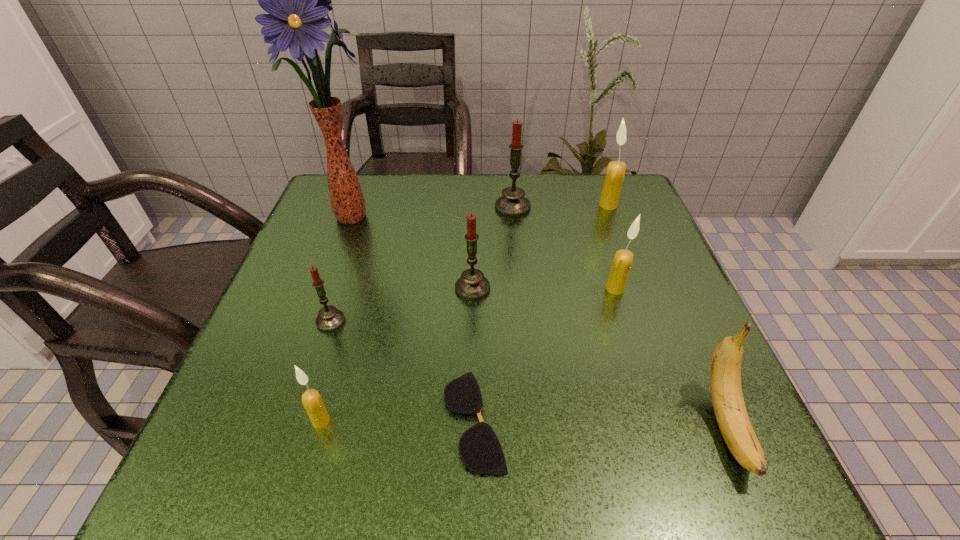
This screenshot has width=960, height=540. Identify the location of empty location between the flower arrangement and the rightmost cream candle. (479, 210).

You are a GUI agent. You are given a task and a screenshot of the screen. Output one action in this format:
    pyautogui.click(x=<x>, y=<y>)
    Task: Click on the free area in between the second nearest cream candle and the eighth object from left to right
    Image resolution: width=960 pixels, height=540 pixels.
    Given the screenshot: What is the action you would take?
    pyautogui.click(x=612, y=247)

Locate an element on the screen. Image resolution: width=960 pixels, height=540 pixels. empty location between the yellow banana and the second nearest cream candle is located at coordinates (671, 358).

Find the location of a particular element. Image resolution: width=960 pixels, height=540 pixels. unoccupied area between the nearest cream candle and the biggest red candle is located at coordinates (417, 314).

Find the location of a particular element. empty location between the smallest cream candle and the rightmost object is located at coordinates (524, 424).

Identify the location of vacant region between the second red candle from right to left and the purple flower arrangement. (411, 252).

Image resolution: width=960 pixels, height=540 pixels. I want to click on free space between the spectacles and the farthest red candle, so click(x=493, y=314).

Image resolution: width=960 pixels, height=540 pixels. Find the location of `vacant point located between the rightmost red candle and the leftmost red candle`. vacant point located between the rightmost red candle and the leftmost red candle is located at coordinates (421, 265).

Identify the location of free spot between the nearest candle and the second candle from right to left. Image resolution: width=960 pixels, height=540 pixels. (468, 355).

I want to click on object that is the seventh closest to the shortest object, so click(x=513, y=204).